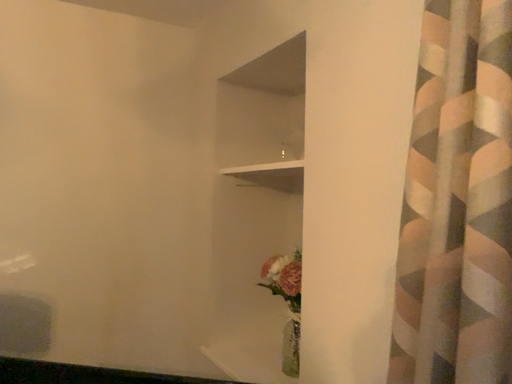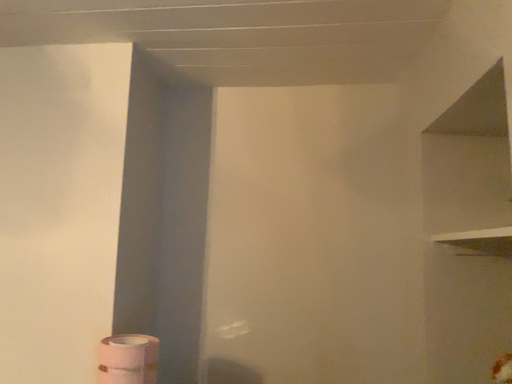
Question: Which way did the camera rotate in the video?

Choices:
 (A) rotated right
 (B) rotated left

Answer: (B)